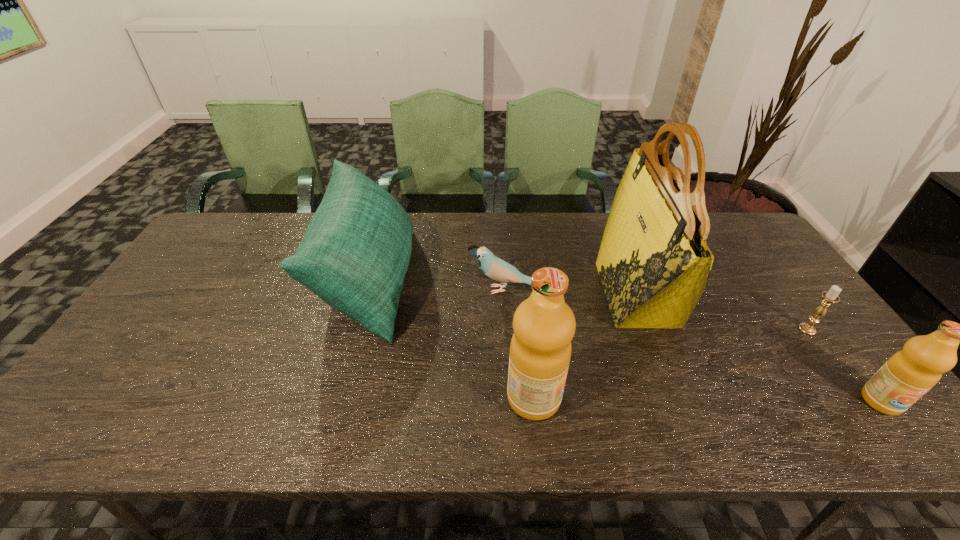
Locate an element on the screen. This screenshot has width=960, height=540. free point located on the left of the candle holder is located at coordinates (729, 329).

Image resolution: width=960 pixels, height=540 pixels. What are the coordinates of `vacant position located 0.370m on the front-facing side of the third object from right to left` in the screenshot? It's located at (477, 294).

I want to click on vacant area located on the front-facing side of the third object from right to left, so click(484, 294).

The width and height of the screenshot is (960, 540). What are the coordinates of `vacant region located 0.360m on the front-facing side of the third object from right to left` in the screenshot? It's located at (481, 294).

The height and width of the screenshot is (540, 960). I want to click on free spot located at the face of the bird, so click(340, 290).

Locate an element on the screen. This screenshot has width=960, height=540. vacant space located at the face of the bird is located at coordinates (404, 290).

The image size is (960, 540). What are the coordinates of `free space located at the face of the bird` in the screenshot? It's located at point(370,290).

Locate an element on the screen. This screenshot has height=540, width=960. cushion located in the far edge section of the desktop is located at coordinates (354, 256).

Locate an element on the screen. tote bag that is at the far edge is located at coordinates (654, 264).

Image resolution: width=960 pixels, height=540 pixels. I want to click on fruit juice that is at the right edge, so click(x=907, y=375).